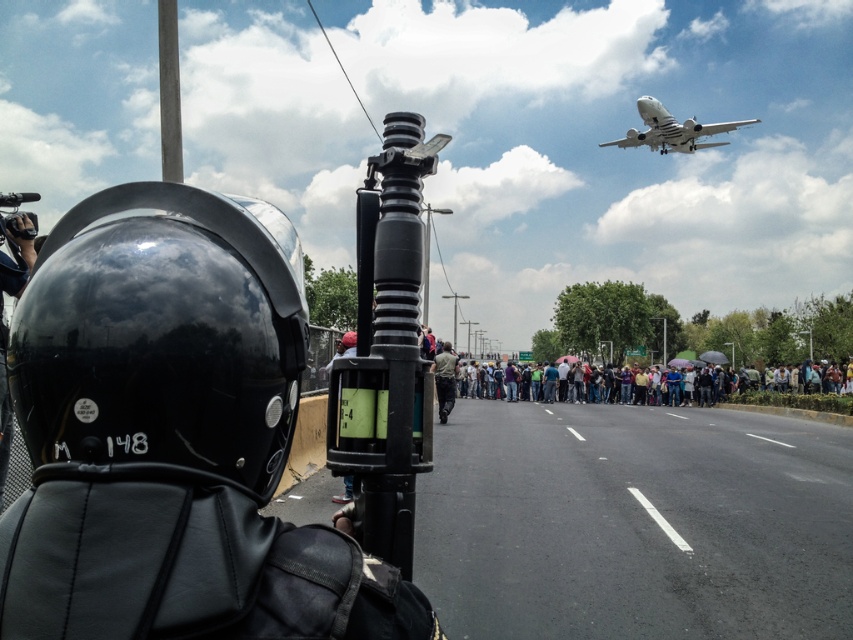
Question: Is the position of matte black helmet at left more distant than that of white matte airplane at upper center?

Choices:
 (A) yes
 (B) no

Answer: (B)

Question: Can you confirm if matte black helmet at left is wider than white matte airplane at upper center?

Choices:
 (A) no
 (B) yes

Answer: (A)

Question: Which of the following is the farthest from the observer?

Choices:
 (A) (659, 131)
 (B) (450, 346)

Answer: (A)

Question: Which point is closer to the camera?

Choices:
 (A) matte black helmet at left
 (B) white matte airplane at upper center

Answer: (A)

Question: Estimate the real-world distances between objects in this image. Which object is farther from the white matte airplane at upper center?

Choices:
 (A) matte black helmet at left
 (B) light brown fabric shirt at center

Answer: (A)

Question: Does matte black helmet at left appear under white matte airplane at upper center?

Choices:
 (A) yes
 (B) no

Answer: (A)